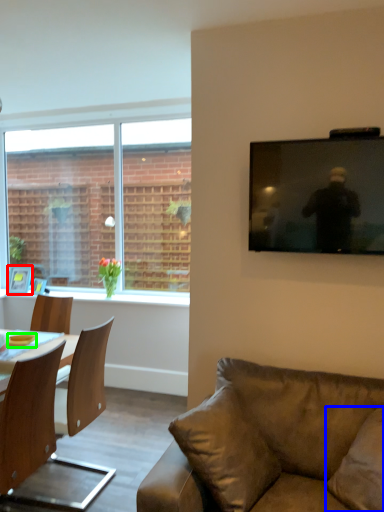
Question: Based on their relative distances, which object is nearer to picture frame (highlighted by a red box)? Choose from pillow (highlighted by a blue box) and bowl (highlighted by a green box).

Choices:
 (A) pillow
 (B) bowl

Answer: (B)